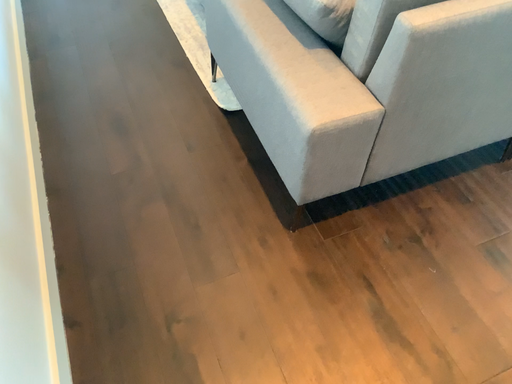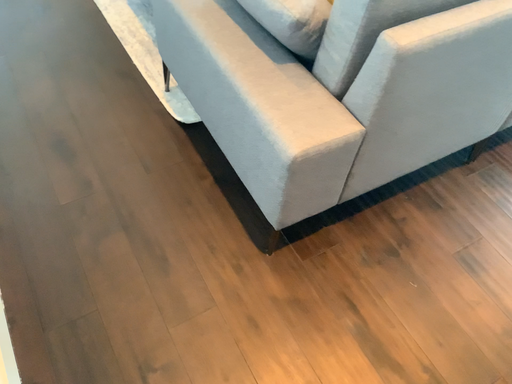
Question: How did the camera likely rotate when shooting the video?

Choices:
 (A) rotated left
 (B) rotated right

Answer: (B)